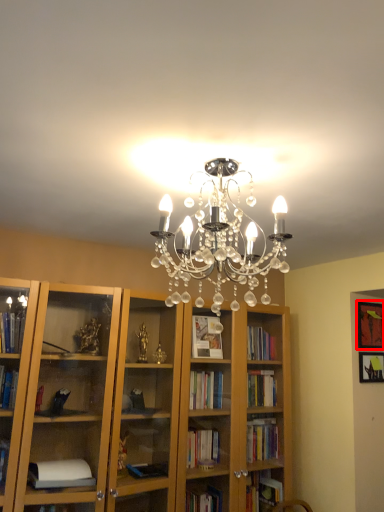
Question: From the image's perspective, considering the relative positions of picture frame (annotated by the red box) and picture frame in the image provided, where is picture frame (annotated by the red box) located with respect to the staircase?

Choices:
 (A) above
 (B) below

Answer: (A)